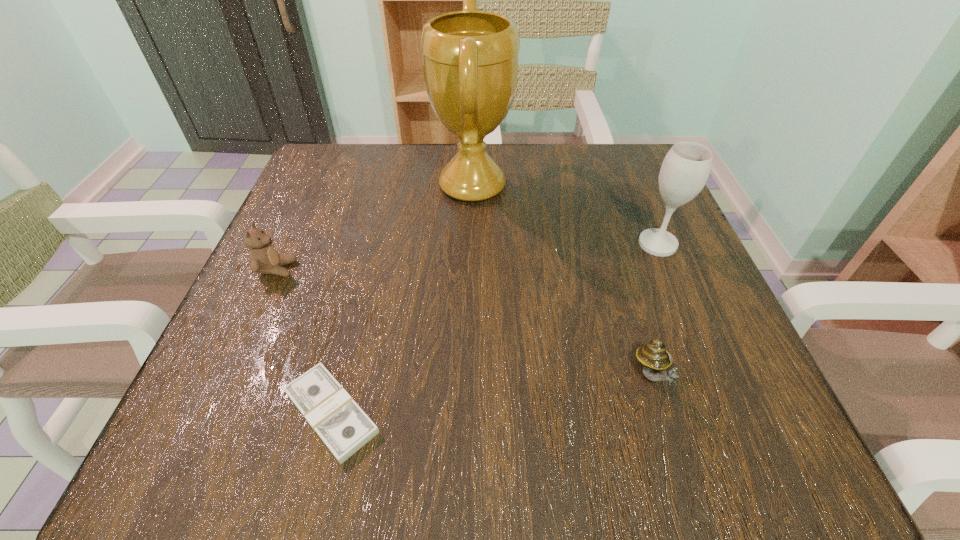
Find the location of `vacant region between the rightmost object and the shortest object`. vacant region between the rightmost object and the shortest object is located at coordinates (494, 328).

This screenshot has height=540, width=960. Identify the location of vacant space that's between the wineglass and the leftmost object. (468, 256).

Locate an element on the screen. Image resolution: width=960 pixels, height=540 pixels. free space between the fourth object from right to left and the award is located at coordinates (402, 299).

Locate an element on the screen. The height and width of the screenshot is (540, 960). empty space that is in between the fourth object from left to right and the leftmost object is located at coordinates (466, 322).

Locate an element on the screen. The width and height of the screenshot is (960, 540). vacant area between the second object from left to right and the fourth object from left to right is located at coordinates (492, 394).

Where is `free space between the third object from right to left and the teddy bear`? Image resolution: width=960 pixels, height=540 pixels. free space between the third object from right to left and the teddy bear is located at coordinates (374, 227).

This screenshot has height=540, width=960. What are the coordinates of `vacant space that is in between the snail and the shortest object` in the screenshot? It's located at (492, 394).

Identify the location of vacant area that lies between the fourth object from left to right and the second object from left to right. [x=492, y=394].

Locate which object ranks in proximity to the snail. Please provide its 2D coordinates. Your answer should be formatted as a tuple, i.e. [(x, y)], where the tuple contains the x and y coordinates of a point satisfying the conditions above.

[(686, 167)]

The image size is (960, 540). Identify the location of the third closest object relative to the rightmost object. (342, 425).